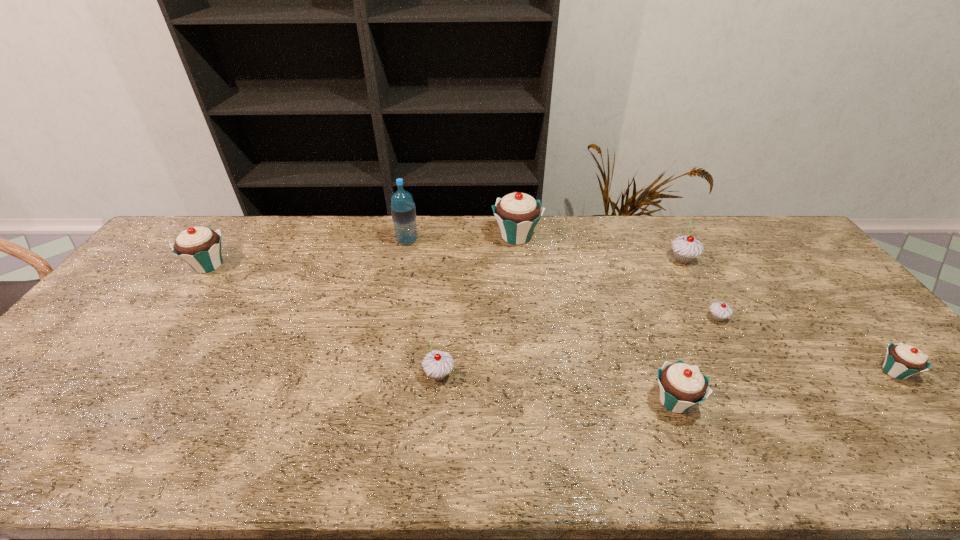
You are a GUI agent. You are given a task and a screenshot of the screen. Output one action in this format:
    pyautogui.click(x=<x>, y=<y>)
    Task: Click on the vacant region between the biggest teal cupcake and the rightmost cupcake
    The image size is (960, 540).
    Given the screenshot: What is the action you would take?
    (706, 304)

What are the coordinates of `vacant area between the second biggest teal cupcake and the leftmost gray cupcake` in the screenshot? It's located at (324, 320).

This screenshot has height=540, width=960. I want to click on free spot between the biggest gray cupcake and the smallest teal cupcake, so click(x=788, y=315).

This screenshot has height=540, width=960. What are the coordinates of `vacant space in between the second farthest gray cupcake and the second object from left to right` in the screenshot? It's located at (563, 279).

The image size is (960, 540). Find the location of `empty space that is in between the biggest gray cupcake and the second farthest gray cupcake`. empty space that is in between the biggest gray cupcake and the second farthest gray cupcake is located at coordinates (700, 289).

The height and width of the screenshot is (540, 960). What are the coordinates of `vacant space that's between the sixth object from right to left and the smallest gray cupcake` in the screenshot? It's located at (578, 346).

Where is `unoccupied position between the sixth object from right to left and the farthest gray cupcake`? The width and height of the screenshot is (960, 540). unoccupied position between the sixth object from right to left and the farthest gray cupcake is located at coordinates tap(561, 317).

In order to click on vacant area between the biggest gray cupcake and the second object from left to right in this screenshot , I will do `click(544, 250)`.

This screenshot has height=540, width=960. I want to click on empty location between the third smallest teal cupcake and the fourth cupcake from left to right, so click(x=442, y=333).

You are a GUI agent. You are given a task and a screenshot of the screen. Output one action in this format:
    pyautogui.click(x=<x>, y=<y>)
    Task: Click on the empty space that is in between the leftmost teal cupcake and the biggest gray cupcake
    
    Given the screenshot: What is the action you would take?
    pyautogui.click(x=445, y=262)